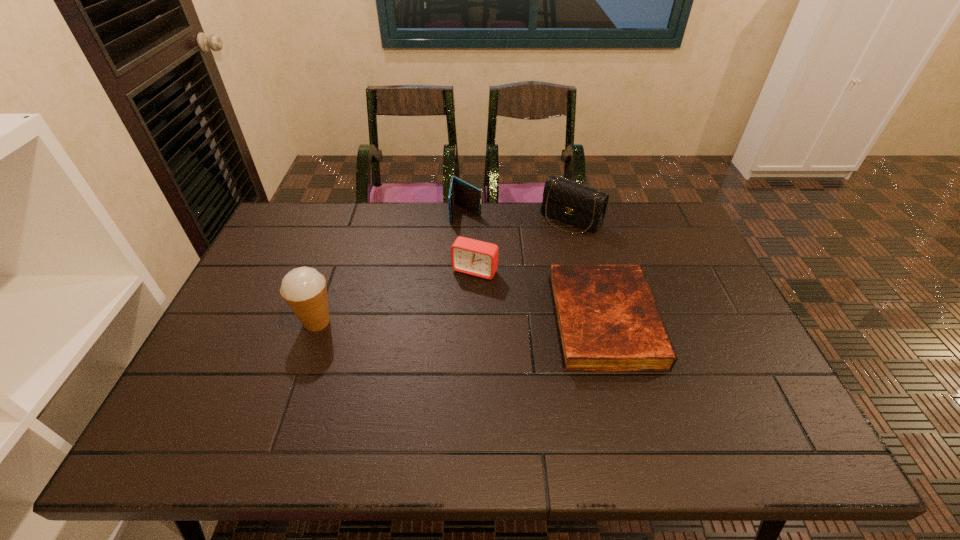
You are a GUI agent. You are given a task and a screenshot of the screen. Output one action in this format:
    pyautogui.click(x=<x>, y=<y>)
    Task: Click on the vacant space on the desktop that is between the icecream and the Bible and is positioned on the exterior surface of the wallet
    This screenshot has width=960, height=540.
    Given the screenshot: What is the action you would take?
    pyautogui.click(x=453, y=321)

The image size is (960, 540). Find the location of `free space on the desktop that is between the icecream and the Bible and is positioned on the front-facing side of the alarm clock`. free space on the desktop that is between the icecream and the Bible and is positioned on the front-facing side of the alarm clock is located at coordinates (447, 321).

This screenshot has width=960, height=540. Identify the location of free space on the desktop that is between the icecream and the shortest object and is positioned on the front flap of the clutch bag. (482, 321).